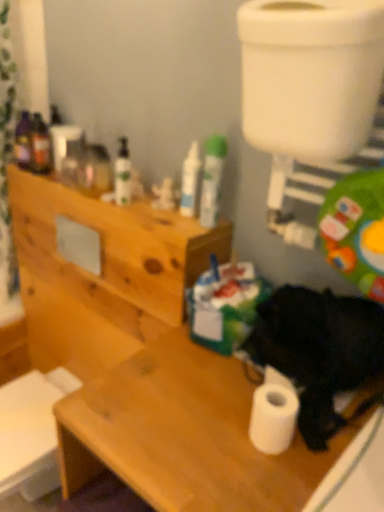
Question: Is wooden cabinet at upper left spatially inside white matte tube at center, which appears as the 1th toiletry when viewed from the right, or outside of it?

Choices:
 (A) inside
 (B) outside

Answer: (B)

Question: Considering the relative positions of wooden cabinet at upper left and white matte tube at center, which appears as the 1th toiletry when viewed from the right, in the image provided, is wooden cabinet at upper left to the left or to the right of white matte tube at center, which appears as the 1th toiletry when viewed from the right,?

Choices:
 (A) right
 (B) left

Answer: (B)

Question: Based on their relative distances, which object is nearer to the white glossy toilet bowl at upper right?

Choices:
 (A) matte green bottle at upper center, which appears as the third toiletry when viewed from the right
 (B) wooden desk at lower right
 (C) white matte tube at center, the 3th toiletry from the left
 (D) white glossy tube at upper center, the 2th toiletry when ordered from right to left
 (E) wooden cabinet at upper left

Answer: (C)

Question: Based on their relative distances, which object is farther from the white glossy tube at upper center, the 2th toiletry when ordered from right to left?

Choices:
 (A) black fur dog at lower right
 (B) wooden desk at lower right
 (C) wooden cabinet at upper left
 (D) white matte tube at center, the 3th toiletry from the left
 (E) white glossy toilet bowl at upper right

Answer: (B)